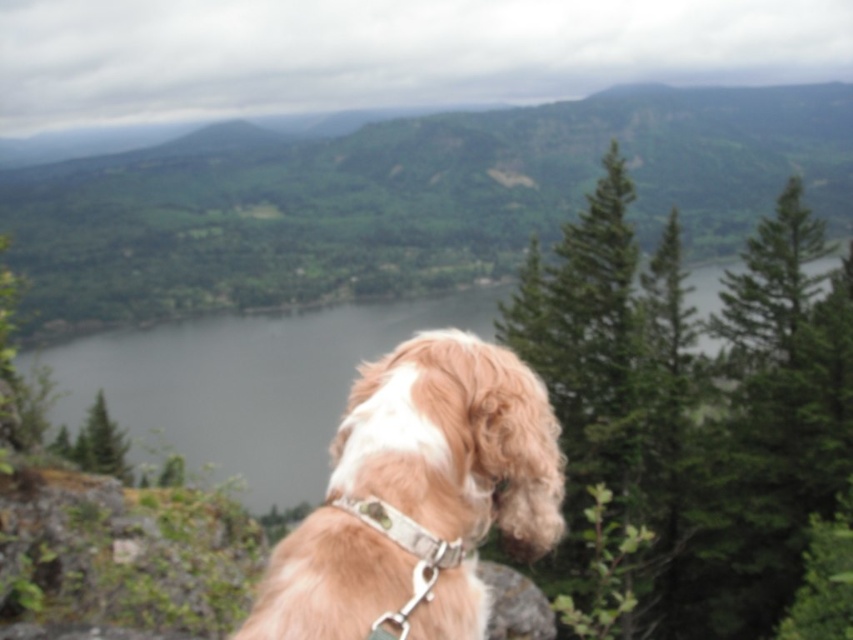
Is green water at center to the right of white fabric neckband at center from the viewer's perspective?

No, green water at center is not to the right of white fabric neckband at center.

Which is behind, point (317, 336) or point (387, 516)?

The point (317, 336) is more distant.

Image resolution: width=853 pixels, height=640 pixels. Identify the location of green water at center. (245, 384).

Between point (518, 426) and point (418, 529), which one is positioned in front?

Point (418, 529)

You are a GUI agent. You are given a task and a screenshot of the screen. Output one action in this format:
    pyautogui.click(x=<x>, y=<y>)
    Task: Click on the golden fur dog at center
    The width and height of the screenshot is (853, 640).
    Given the screenshot: What is the action you would take?
    418,497

Does golden fur dog at center appear over green water at center?

Actually, golden fur dog at center is below green water at center.

Is point (405, 541) closer to camera compared to point (300, 428)?

Yes, it is in front of point (300, 428).

Locate an element on the screen. golden fur dog at center is located at coordinates (418, 497).